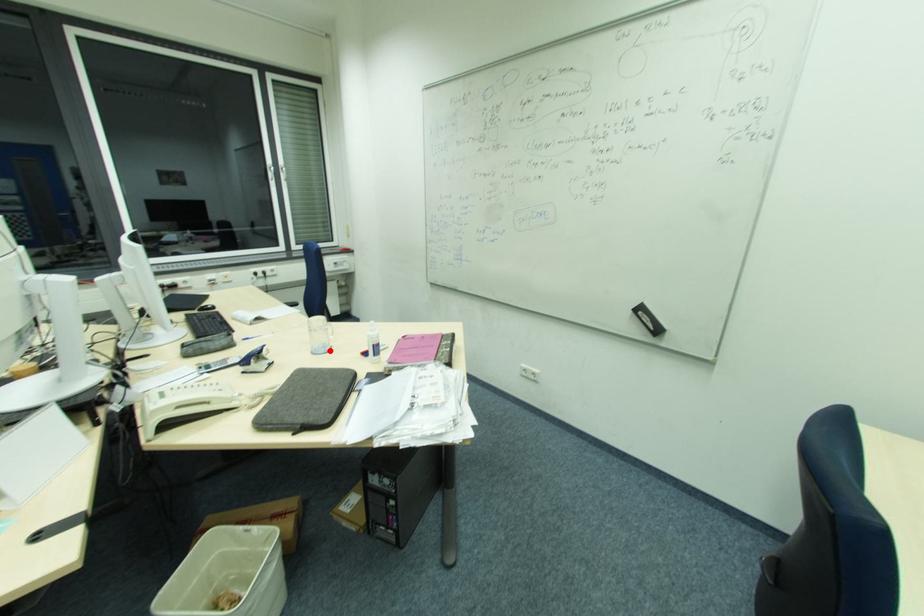
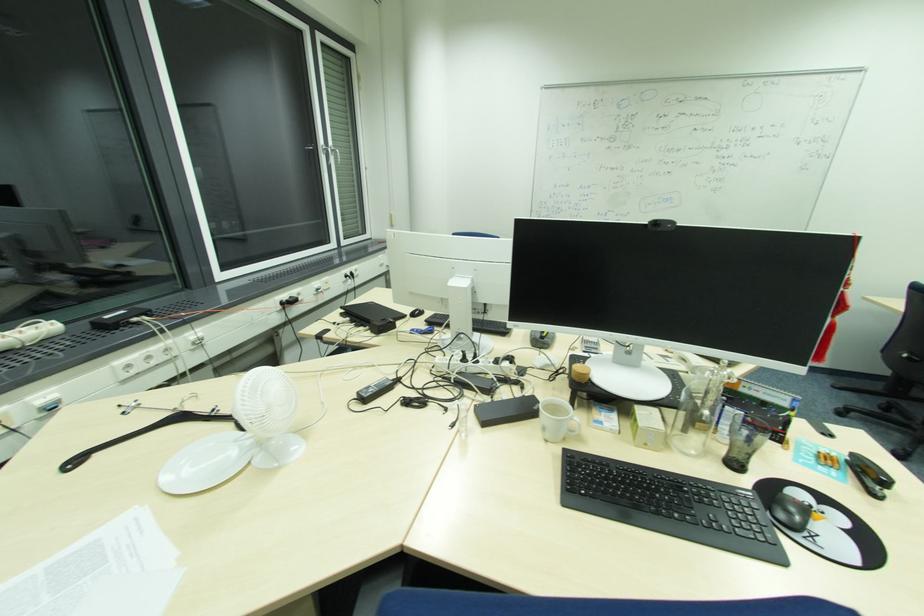
Question: I am providing you with two images of the same scene from different viewpoints. A red point is marked on the first image. Can you still see the location of the red point in image 2?

Choices:
 (A) Yes
 (B) No

Answer: (B)